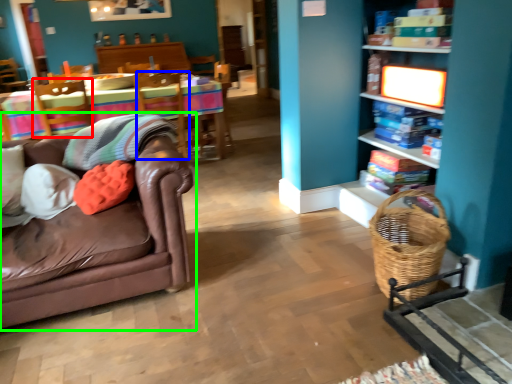
Question: Which object is positioned farthest from swivel chair (highlighted by a red box)? Select from swivel chair (highlighted by a blue box) and studio couch (highlighted by a green box).

Choices:
 (A) swivel chair
 (B) studio couch

Answer: (B)